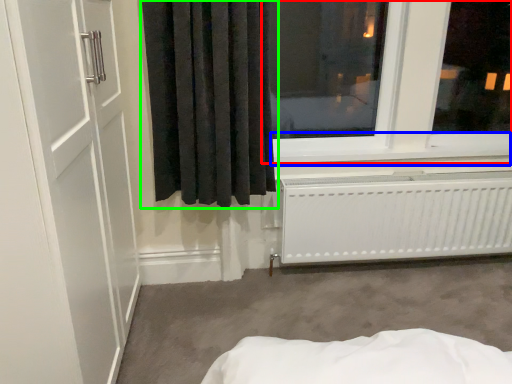
Question: Which is farther away from window (highlighted by a red box)? window sill (highlighted by a blue box) or curtain (highlighted by a green box)?

Choices:
 (A) window sill
 (B) curtain

Answer: (B)